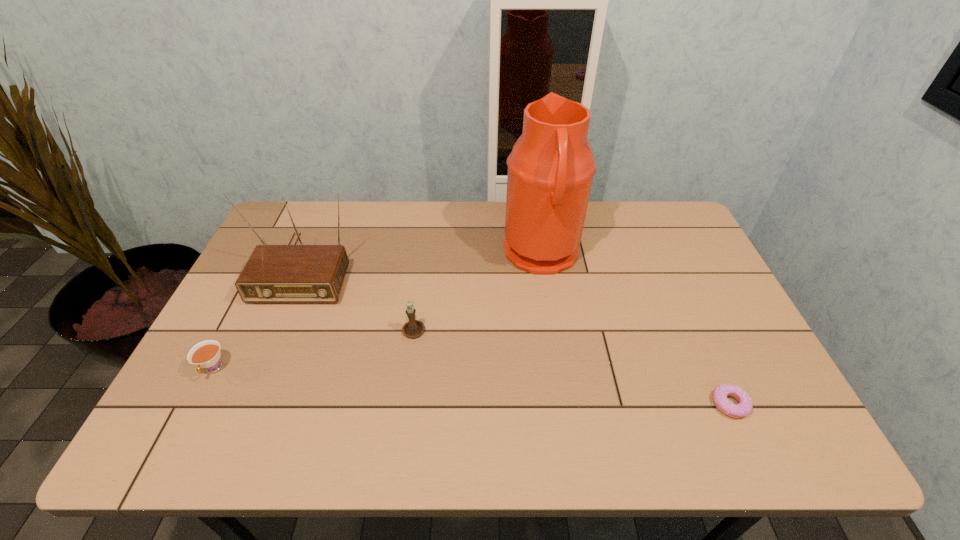
Where is `vacant space situated from the spout of the water jug`? The height and width of the screenshot is (540, 960). vacant space situated from the spout of the water jug is located at coordinates (419, 254).

Where is `free spot located from the spout of the water jug`? The width and height of the screenshot is (960, 540). free spot located from the spout of the water jug is located at coordinates (412, 254).

Find the location of a particular element. This screenshot has width=960, height=540. vacant space located 0.360m on the front panel of the radio_receiver is located at coordinates (239, 424).

Find the location of `free space located 0.280m on the side of the third tallest object with the handle`. free space located 0.280m on the side of the third tallest object with the handle is located at coordinates (424, 252).

Locate an element on the screen. free space located on the side of the third tallest object with the handle is located at coordinates (422, 271).

What are the coordinates of `free space located 0.180m on the side of the third tallest object with the handle` in the screenshot? It's located at (421, 273).

Locate an element on the screen. free space located on the side of the teacup with the handle is located at coordinates (190, 413).

This screenshot has width=960, height=540. What are the coordinates of `vacant space situated on the left of the shortest object` in the screenshot? It's located at (680, 404).

Locate an element on the screen. The height and width of the screenshot is (540, 960). water jug located in the far edge section of the desktop is located at coordinates (550, 170).

This screenshot has width=960, height=540. Find the location of `radio_receiver at the far edge`. radio_receiver at the far edge is located at coordinates (288, 273).